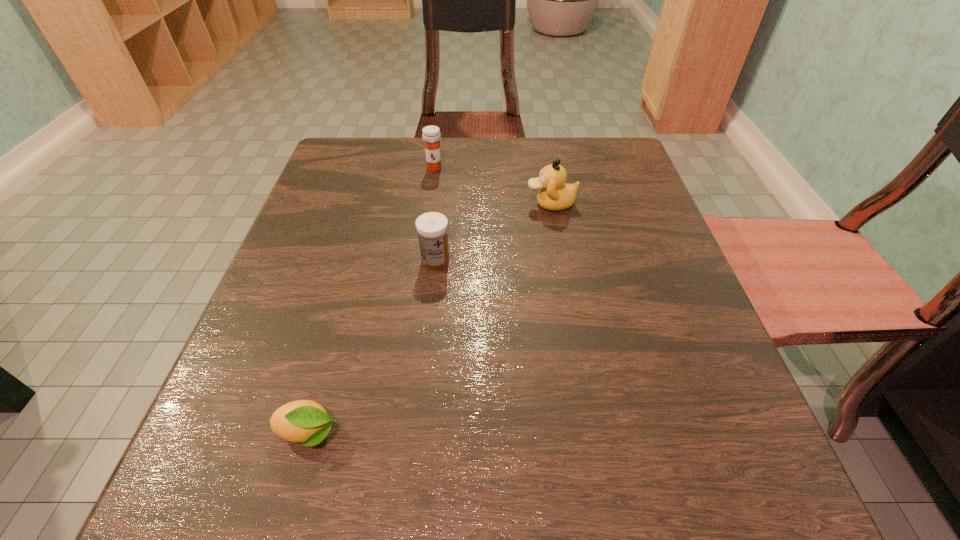
Identify the location of the rightmost object. The image size is (960, 540). (555, 194).

Where is `the second farthest object`? the second farthest object is located at coordinates (555, 194).

You are a GUI agent. You are given a task and a screenshot of the screen. Output one action in this format:
    pyautogui.click(x=<x>, y=<y>)
    Task: Click on the farthest object
    The width and height of the screenshot is (960, 540).
    Given the screenshot: What is the action you would take?
    pyautogui.click(x=431, y=135)

Find the location of a particular element. This screenshot has width=960, height=540. the third farthest object is located at coordinates (432, 227).

This screenshot has width=960, height=540. I want to click on the nearest object, so click(x=303, y=421).

What are the coordinates of `lemon` in the screenshot? It's located at (303, 421).

Image resolution: width=960 pixels, height=540 pixels. I want to click on vacant space located 0.310m on the face of the second farthest object, so click(x=381, y=204).

Identify the location of free space located on the face of the second farthest object. This screenshot has width=960, height=540. (489, 204).

Locate an element on the screen. The width and height of the screenshot is (960, 540). vacant area situated on the face of the second farthest object is located at coordinates (353, 204).

Find the location of `vacant region located 0.090m on the label side of the farthest object`. vacant region located 0.090m on the label side of the farthest object is located at coordinates (430, 195).